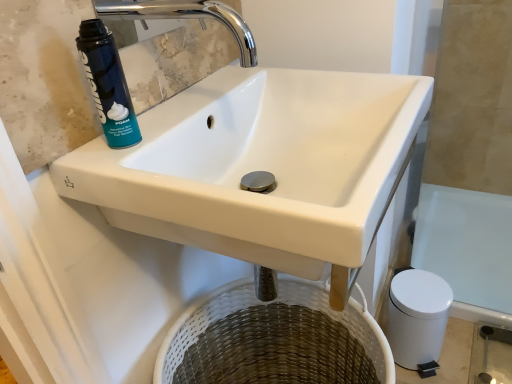
Question: Is chrome metallic faucet at upper center at the right side of white ceramic sink at upper center?

Choices:
 (A) yes
 (B) no

Answer: (B)

Question: Can you confirm if chrome metallic faucet at upper center is positioned to the left of white ceramic sink at upper center?

Choices:
 (A) no
 (B) yes

Answer: (B)

Question: Considering the relative sizes of chrome metallic faucet at upper center and white ceramic sink at upper center in the image provided, is chrome metallic faucet at upper center smaller than white ceramic sink at upper center?

Choices:
 (A) no
 (B) yes

Answer: (B)

Question: Considering the relative sizes of chrome metallic faucet at upper center and white ceramic sink at upper center in the image provided, is chrome metallic faucet at upper center thinner than white ceramic sink at upper center?

Choices:
 (A) no
 (B) yes

Answer: (B)

Question: Is chrome metallic faucet at upper center in contact with white ceramic sink at upper center?

Choices:
 (A) no
 (B) yes

Answer: (A)

Question: Is chrome metallic faucet at upper center facing away from white ceramic sink at upper center?

Choices:
 (A) no
 (B) yes

Answer: (A)

Question: Is blue matte shaving cream can at upper left to the right of woven white basket at lower center from the viewer's perspective?

Choices:
 (A) no
 (B) yes

Answer: (A)

Question: From the image's perspective, is blue matte shaving cream can at upper left under woven white basket at lower center?

Choices:
 (A) yes
 (B) no

Answer: (B)

Question: Is blue matte shaving cream can at upper left directly adjacent to woven white basket at lower center?

Choices:
 (A) yes
 (B) no

Answer: (B)

Question: Is blue matte shaving cream can at upper left smaller than woven white basket at lower center?

Choices:
 (A) yes
 (B) no

Answer: (A)

Question: Is blue matte shaving cream can at upper left taller than woven white basket at lower center?

Choices:
 (A) yes
 (B) no

Answer: (B)

Question: Does blue matte shaving cream can at upper left contain woven white basket at lower center?

Choices:
 (A) yes
 (B) no

Answer: (B)

Question: Is blue matte shaving cream can at upper left located outside white ceramic sink at upper center?

Choices:
 (A) yes
 (B) no

Answer: (A)